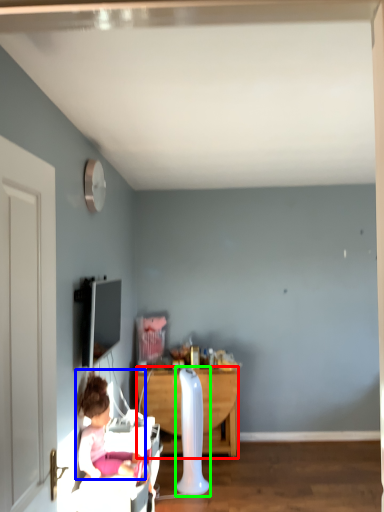
Question: Considering the real-world distances, which object is closest to desk (highlighted by a red box)? person (highlighted by a blue box) or radiator (highlighted by a green box).

Choices:
 (A) person
 (B) radiator

Answer: (B)